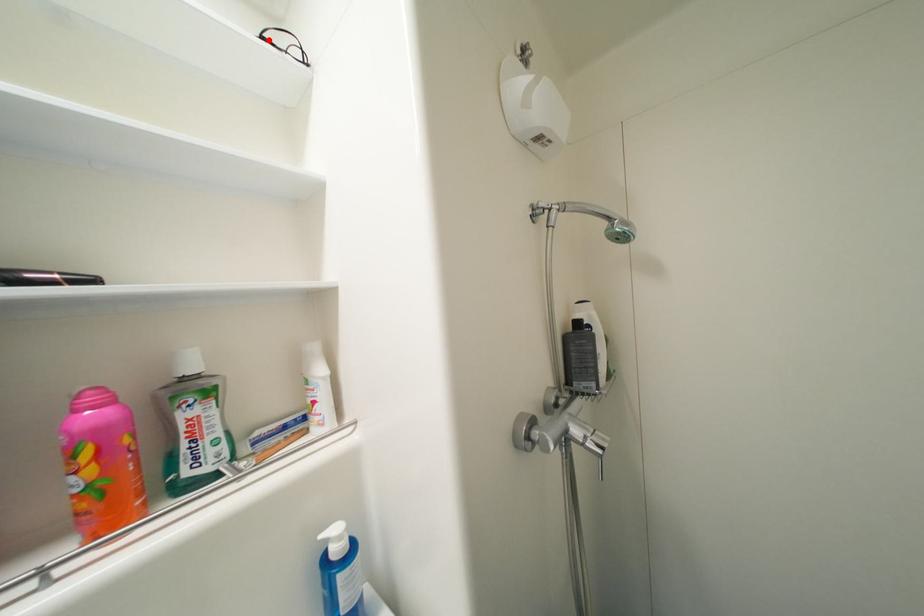
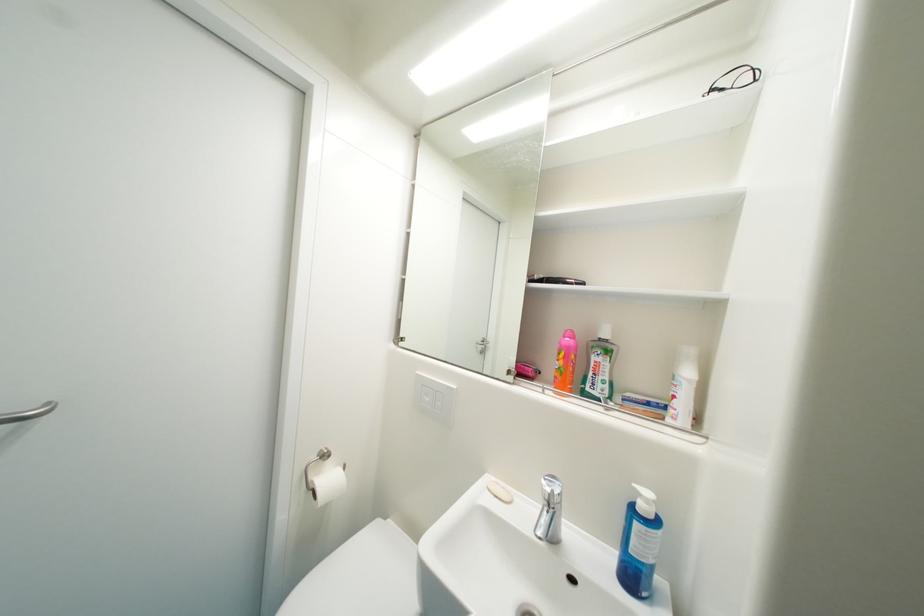
Where in the second image is the point corresponding to the highlighted location from the first image?

(718, 92)